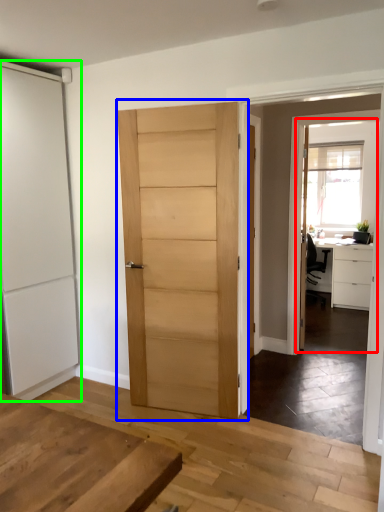
Question: Based on their relative distances, which object is nearer to screen door (highlighted by a red box)? Choose from door (highlighted by a blue box) and door (highlighted by a green box).

Choices:
 (A) door
 (B) door

Answer: (A)